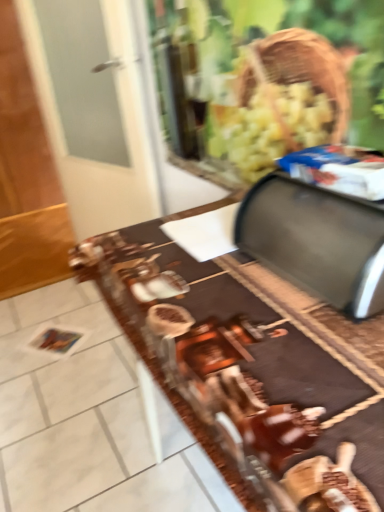
What is the approximate width of brown glossy table at center?

It is 19.75 inches.

What do you see at coordinates (244, 355) in the screenshot? Image resolution: width=384 pixels, height=512 pixels. I see `brown glossy table at center` at bounding box center [244, 355].

Measure the distance between brown glossy table at center and camera.

15.66 inches.

Measure the distance between point (272, 401) and camera.

A distance of 20.16 inches exists between point (272, 401) and camera.

The width and height of the screenshot is (384, 512). In order to click on brown glossy table at center in this screenshot , I will do `click(244, 355)`.

Identify the location of satin silver breadbox at upper right. (311, 236).

Describe the element at coordinates (311, 236) in the screenshot. The height and width of the screenshot is (512, 384). I see `satin silver breadbox at upper right` at that location.

Find the location of a particular element. brown glossy table at center is located at coordinates (244, 355).

Which object is positioned more to the right, brown glossy table at center or satin silver breadbox at upper right?

satin silver breadbox at upper right.

Which is behind, brown glossy table at center or satin silver breadbox at upper right?

satin silver breadbox at upper right is behind.

Is point (312, 380) farther from camera compared to point (236, 227)?

No, it is not.

From the image's perspective, which one is positioned higher, brown glossy table at center or satin silver breadbox at upper right?

satin silver breadbox at upper right, from the image's perspective.

From a real-world perspective, who is located lower, brown glossy table at center or satin silver breadbox at upper right?

In real-world perspective, brown glossy table at center is lower.

Which of these two, brown glossy table at center or satin silver breadbox at upper right, is thinner?

Thinner between the two is satin silver breadbox at upper right.

Between brown glossy table at center and satin silver breadbox at upper right, which one has less height?

Standing shorter between the two is satin silver breadbox at upper right.

Does brown glossy table at center have a larger size compared to satin silver breadbox at upper right?

Yes.

Would you say brown glossy table at center contains satin silver breadbox at upper right?

No.

Would you say brown glossy table at center is a long distance from satin silver breadbox at upper right?

Actually, brown glossy table at center and satin silver breadbox at upper right are a little close together.

Is brown glossy table at center facing towards satin silver breadbox at upper right?

No, brown glossy table at center is not oriented towards satin silver breadbox at upper right.

Identify the location of wide behind the brown glossy table at center. This screenshot has width=384, height=512. (311, 236).

Is satin silver breadbox at upper right to the right of brown glossy table at center from the viewer's perspective?

Indeed, satin silver breadbox at upper right is positioned on the right side of brown glossy table at center.

Looking at this image, is satin silver breadbox at upper right closer to the viewer compared to brown glossy table at center?

No, satin silver breadbox at upper right is behind brown glossy table at center.

Is point (266, 183) closer to camera compared to point (327, 306)?

No.

From the image's perspective, does satin silver breadbox at upper right appear lower than brown glossy table at center?

Actually, satin silver breadbox at upper right appears above brown glossy table at center in the image.

From a real-world perspective, is satin silver breadbox at upper right below brown glossy table at center?

No, from a real-world perspective, satin silver breadbox at upper right is not below brown glossy table at center.

Which of these two, satin silver breadbox at upper right or brown glossy table at center, is thinner?

satin silver breadbox at upper right.

In terms of height, does satin silver breadbox at upper right look taller or shorter compared to brown glossy table at center?

Considering their sizes, satin silver breadbox at upper right has less height than brown glossy table at center.

Considering the sizes of objects satin silver breadbox at upper right and brown glossy table at center in the image provided, who is smaller, satin silver breadbox at upper right or brown glossy table at center?

With smaller size is satin silver breadbox at upper right.

Can brown glossy table at center be found inside satin silver breadbox at upper right?

That's incorrect, brown glossy table at center is not inside satin silver breadbox at upper right.

Based on the photo, would you consider satin silver breadbox at upper right to be distant from brown glossy table at center?

satin silver breadbox at upper right is actually quite close to brown glossy table at center.

Is satin silver breadbox at upper right facing away from brown glossy table at center?

No, satin silver breadbox at upper right is not facing the opposite direction of brown glossy table at center.

How distant is satin silver breadbox at upper right from brown glossy table at center?

6.74 inches.

In order to click on wide behind the brown glossy table at center in this screenshot , I will do (311, 236).

This screenshot has width=384, height=512. Identify the location of wide that is above the brown glossy table at center (from a real-world perspective). (311, 236).

Locate an element on the screen. table on the left of satin silver breadbox at upper right is located at coordinates (244, 355).